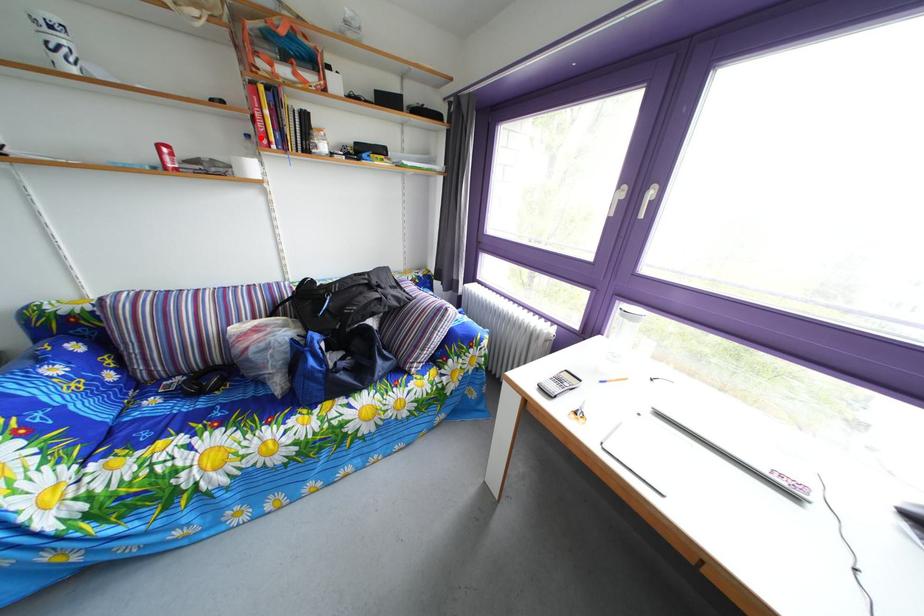
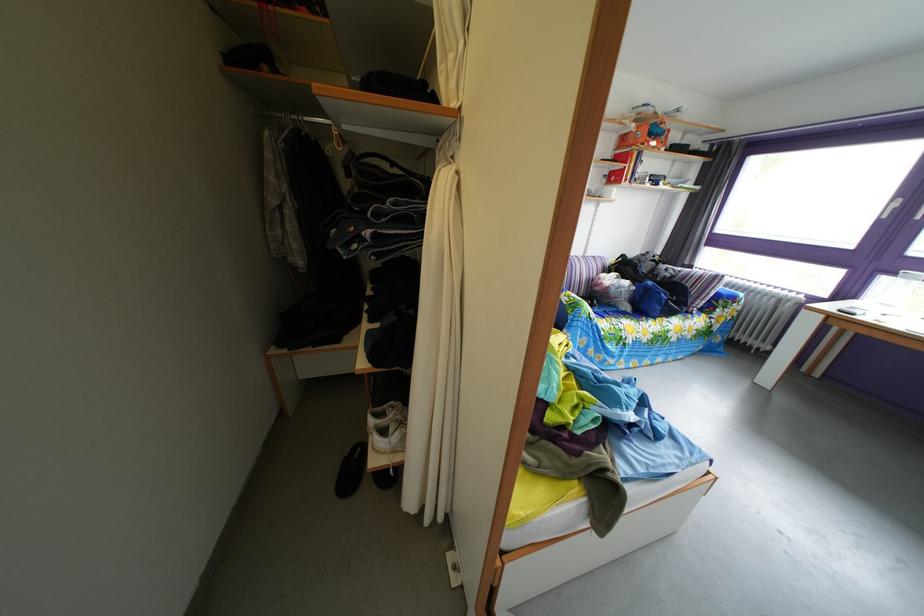
The point at the highlighted location is marked in the first image. Where is the corresponding point in the second image?

(618, 180)